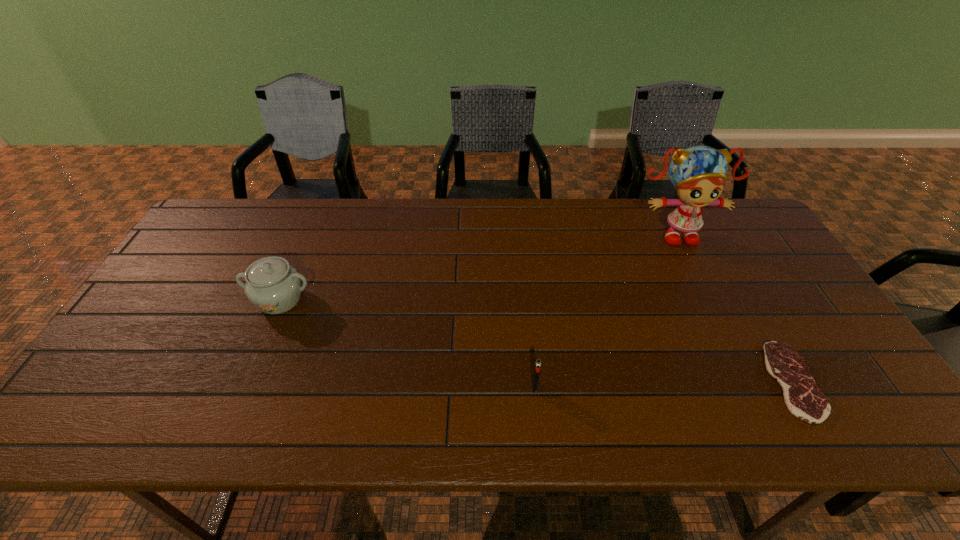
This screenshot has height=540, width=960. I want to click on empty space that is in between the third shortest object and the igniter, so click(407, 343).

Find the location of a particular element. The image size is (960, 540). vacant area between the second object from left to right and the leftmost object is located at coordinates [x=407, y=343].

This screenshot has width=960, height=540. In order to click on free point between the shortest object and the leftmost object in this screenshot , I will do `click(537, 340)`.

Locate which object ranks third in proximity to the farthest object. Please provide its 2D coordinates. Your answer should be formatted as a tuple, i.e. [(x, y)], where the tuple contains the x and y coordinates of a point satisfying the conditions above.

[(272, 285)]

Image resolution: width=960 pixels, height=540 pixels. In order to click on the third closest object to the tallest object in this screenshot , I will do `click(272, 285)`.

Locate an element on the screen. This screenshot has width=960, height=540. vacant space that satisfies the following two spatial constraints: 1. on the front side of the chinaware; 2. on the right side of the shortest object is located at coordinates (245, 381).